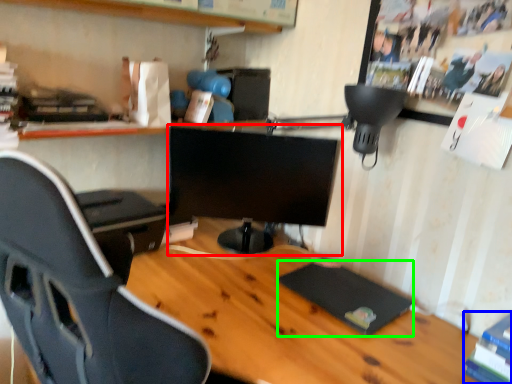
Question: Which object is the closest to the computer monitor (highlighted by a red box)? Choose among these: book (highlighted by a blue box) or pad (highlighted by a green box).

Choices:
 (A) book
 (B) pad

Answer: (B)